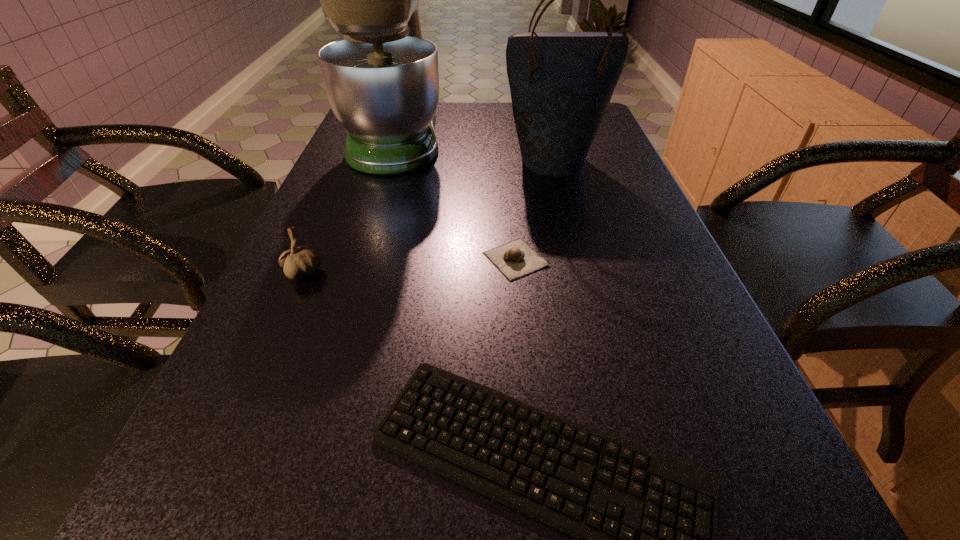
You are a GUI agent. You are given a task and a screenshot of the screen. Output one action in this format:
    pyautogui.click(x=<x>, y=<y>)
    Task: Click on the free spot that satisfies the following two spatial constraints: 1. on the controls of the mixer; 2. on the back side of the fourth shortest object
    
    Given the screenshot: What is the action you would take?
    pyautogui.click(x=390, y=160)

You are a GUI agent. You are given a task and a screenshot of the screen. Output one action in this format:
    pyautogui.click(x=<x>, y=<y>)
    Task: Click on the free region that satisfies the following two spatial constraints: 1. on the controls of the mixer; 2. on the left side of the shopping bag
    This screenshot has height=540, width=960.
    Given the screenshot: What is the action you would take?
    pyautogui.click(x=390, y=160)

Where is `free space that satisfies the following two spatial constraints: 1. on the controls of the mixer; 2. on the front side of the third tallest object`? This screenshot has height=540, width=960. free space that satisfies the following two spatial constraints: 1. on the controls of the mixer; 2. on the front side of the third tallest object is located at coordinates (354, 273).

You are a GUI agent. You are given a task and a screenshot of the screen. Output one action in this format:
    pyautogui.click(x=<x>, y=<y>)
    Task: Click on the free space that satisfies the following two spatial constraints: 1. on the back side of the shopping bag; 2. on the right side of the third shortest object
    Image resolution: width=960 pixels, height=540 pixels.
    Given the screenshot: What is the action you would take?
    pyautogui.click(x=353, y=160)